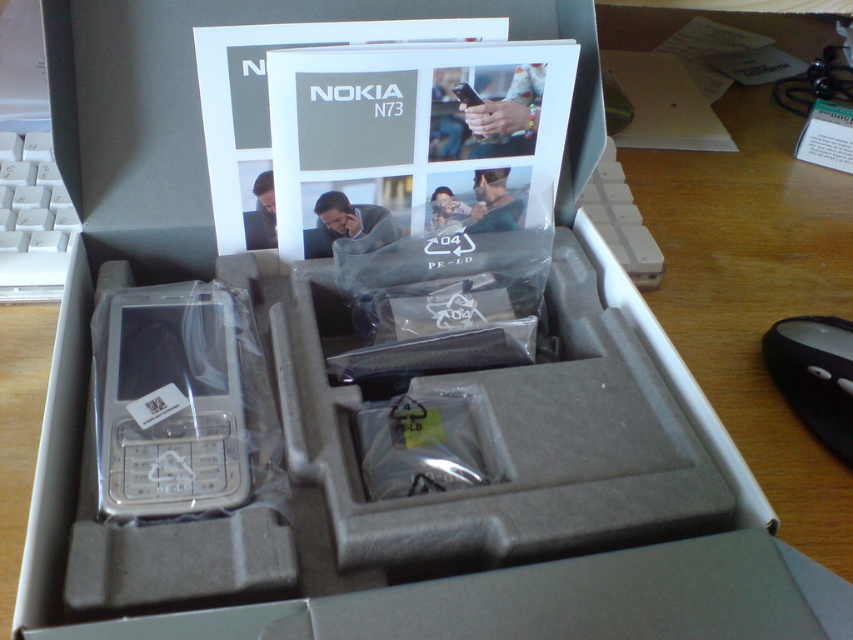
You are setting up a new computer and need to place both the silver metallic phone at center and the black plastic mouse at lower right on your desk. Given their sizes, which item will require more vertical space?

The silver metallic phone at center is much taller than the black plastic mouse at lower right, so it will require more vertical space.

You are setting up a home office and need to place a white plastic keyboard at upper left and a black plastic mouse at lower right on your desk. Given that your desk is 60 centimeters wide, will both items fit side by side without overlapping?

The white plastic keyboard at upper left is 60.93 centimeters away from the black plastic mouse at lower right. Since the desk is only 60 centimeters wide, the items will not fit side by side without overlapping as the distance between them exceeds the desk width.